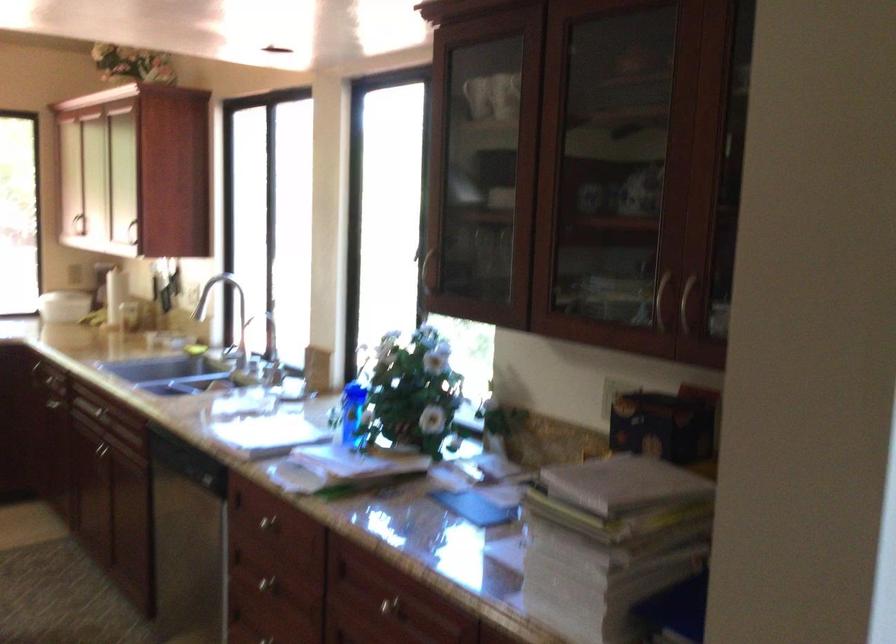
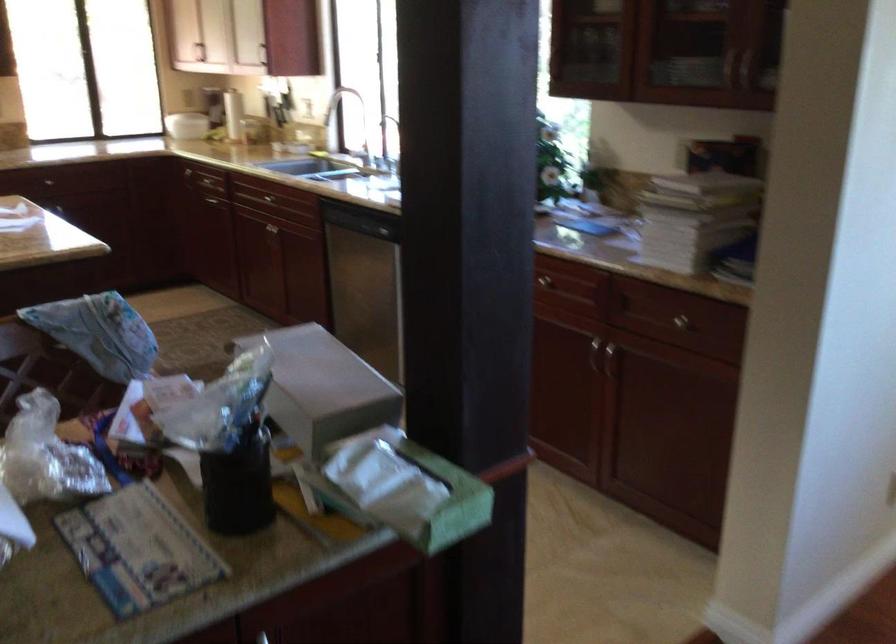
Question: I am providing you with two images of the same scene from different viewpoints. Please identify which objects are invisible in image2.

Choices:
 (A) grey cardboard box
 (B) green tissue box
 (C) white hackathon sign
 (D) silver cabinet handle

Answer: (D)